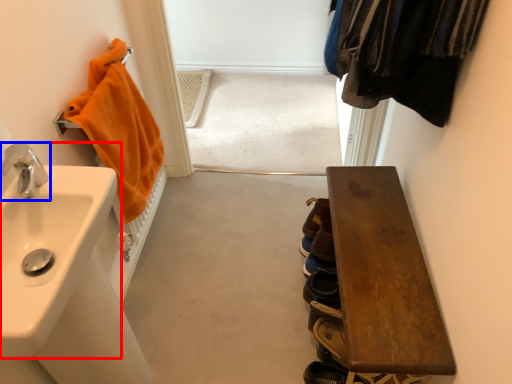
Question: Which point is closer to the camera, sink (highlighted by a red box) or tap (highlighted by a blue box)?

Choices:
 (A) sink
 (B) tap

Answer: (A)